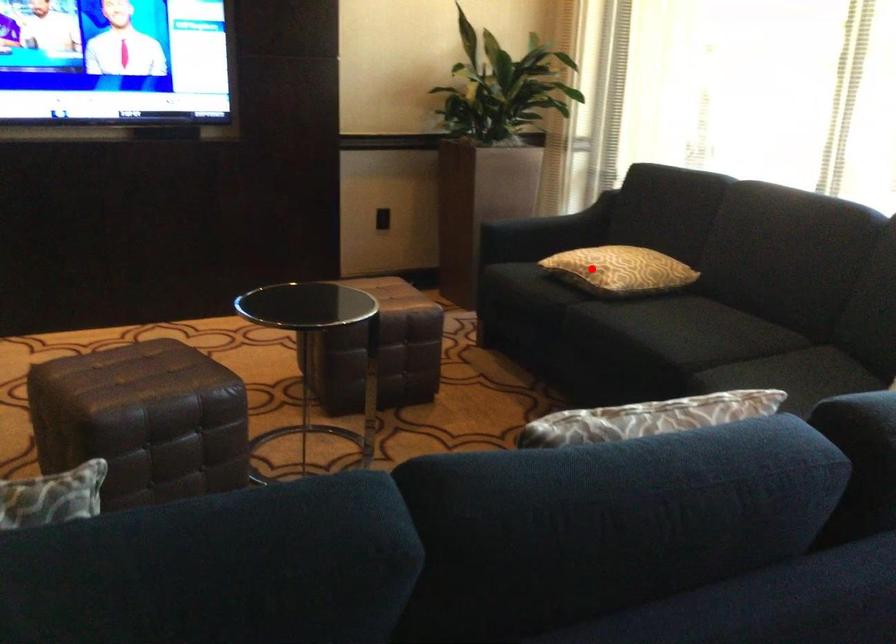
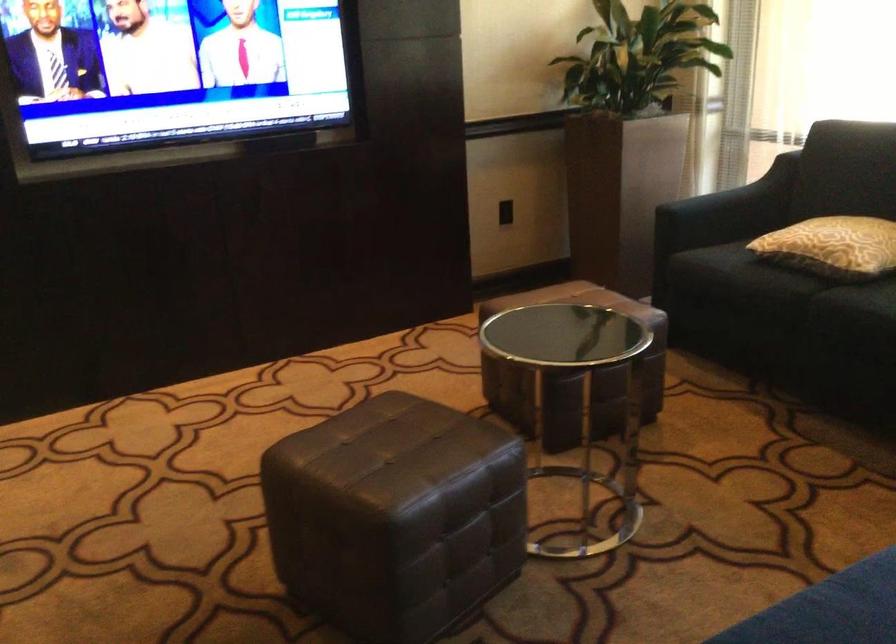
Question: I am providing you with two images of the same scene from different viewpoints. In image1, a red point is highlighted. Considering the same 3D point in image2, which of the following is correct?

Choices:
 (A) It is closer
 (B) It is farther

Answer: (A)